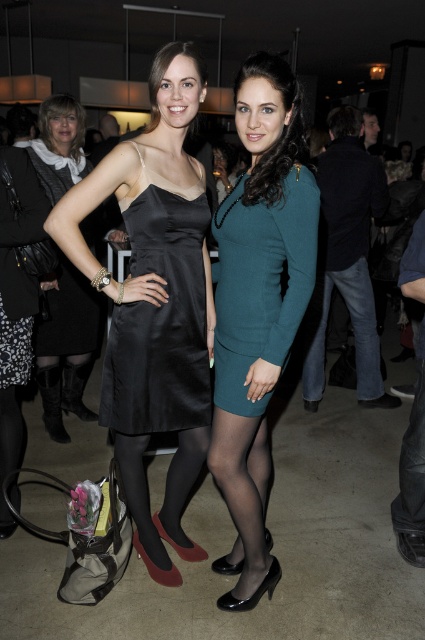
You are standing in the same room as the two women in the image. There are two points marked in the image at coordinates point [248,298] and point [255,227]. Which point is closer to you?

Point [248,298] is further to the viewer than point [255,227], so the closer point to you is point [248,298].